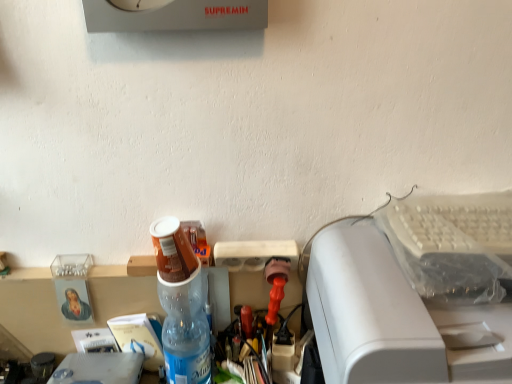
Question: Is white plastic printer at right oriented away from translucent plastic bottle at center?

Choices:
 (A) no
 (B) yes

Answer: (A)

Question: From the image's perspective, is white plastic printer at right over translucent plastic bottle at center?

Choices:
 (A) no
 (B) yes

Answer: (A)

Question: Considering the relative positions of white plastic printer at right and translucent plastic bottle at center in the image provided, is white plastic printer at right in front of translucent plastic bottle at center?

Choices:
 (A) yes
 (B) no

Answer: (A)

Question: Would you say translucent plastic bottle at center is part of white plastic printer at right's contents?

Choices:
 (A) yes
 (B) no

Answer: (B)

Question: Is white plastic printer at right positioned behind translucent plastic bottle at center?

Choices:
 (A) no
 (B) yes

Answer: (A)

Question: Would you say white plastic printer at right is outside translucent plastic bottle at center?

Choices:
 (A) yes
 (B) no

Answer: (A)

Question: Is translucent plastic bottle at center taller than white plastic printer at right?

Choices:
 (A) no
 (B) yes

Answer: (A)

Question: Is white plastic printer at right at the back of translucent plastic bottle at center?

Choices:
 (A) yes
 (B) no

Answer: (B)

Question: Can you confirm if translucent plastic bottle at center is positioned to the left of white plastic printer at right?

Choices:
 (A) yes
 (B) no

Answer: (A)

Question: From a real-world perspective, is translucent plastic bottle at center over white plastic printer at right?

Choices:
 (A) yes
 (B) no

Answer: (B)

Question: From the image's perspective, is translucent plastic bottle at center under white plastic printer at right?

Choices:
 (A) yes
 (B) no

Answer: (B)

Question: Would you consider translucent plastic bottle at center to be distant from white plastic printer at right?

Choices:
 (A) yes
 (B) no

Answer: (B)

Question: Relative to translucent plastic bottle at center, is white plastic printer at right in front or behind?

Choices:
 (A) front
 (B) behind

Answer: (A)